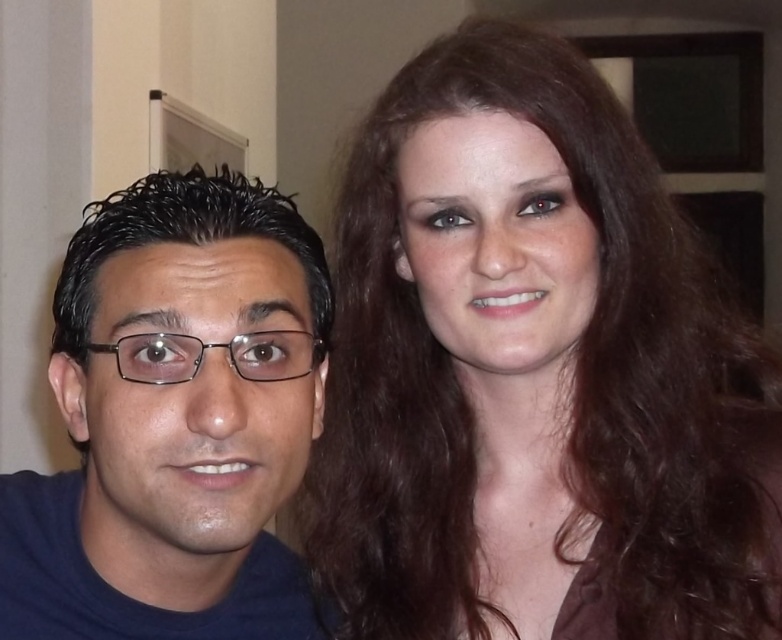
Between smooth brown hair at right and matte black glasses at left, which one appears on the right side from the viewer's perspective?

Positioned to the right is smooth brown hair at right.

Is smooth brown hair at right to the left of matte black glasses at left from the viewer's perspective?

No, smooth brown hair at right is not to the left of matte black glasses at left.

You are a GUI agent. You are given a task and a screenshot of the screen. Output one action in this format:
    pyautogui.click(x=<x>, y=<y>)
    Task: Click on the smooth brown hair at right
    
    Given the screenshot: What is the action you would take?
    pyautogui.click(x=533, y=372)

I want to click on smooth brown hair at right, so click(x=533, y=372).